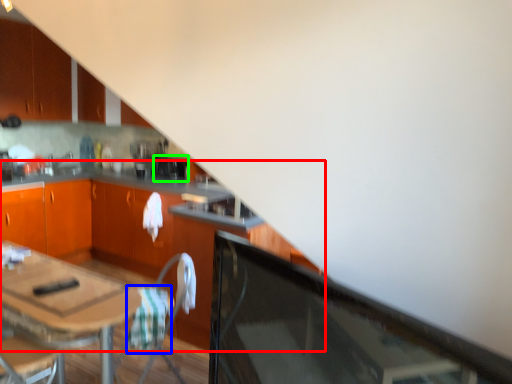
Question: Estimate the real-world distances between objects in this image. Which object is closer to cabinetry (highlighted by a red box), blanket (highlighted by a blue box) or appliance (highlighted by a green box)?

Choices:
 (A) blanket
 (B) appliance

Answer: (B)